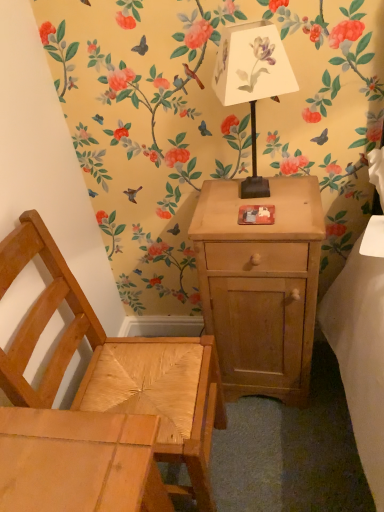
Locate an element on the screen. The image size is (384, 512). vacant area that is situated to the right of white paper lampshade at upper center is located at coordinates (297, 194).